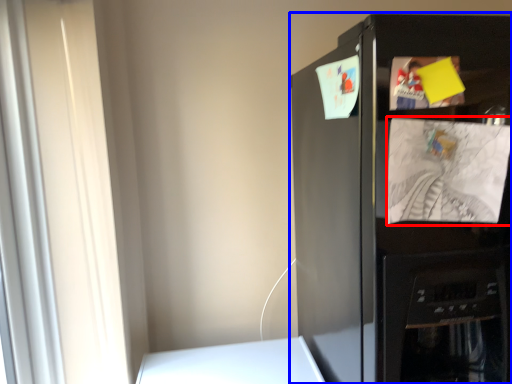
Question: Among these objects, which one is nearest to the camera, paper (highlighted by a red box) or refrigerator (highlighted by a blue box)?

Choices:
 (A) paper
 (B) refrigerator

Answer: (B)